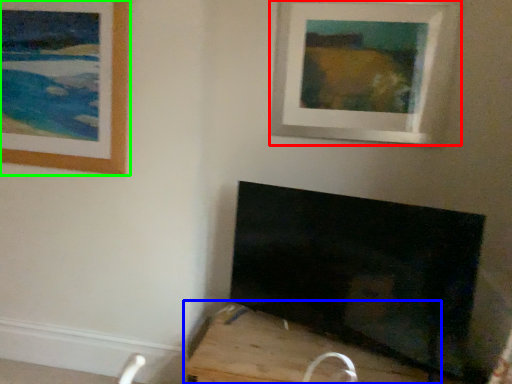
Question: Considering the real-world distances, which object is farthest from picture frame (highlighted by a red box)? furniture (highlighted by a blue box) or picture frame (highlighted by a green box)?

Choices:
 (A) furniture
 (B) picture frame

Answer: (A)